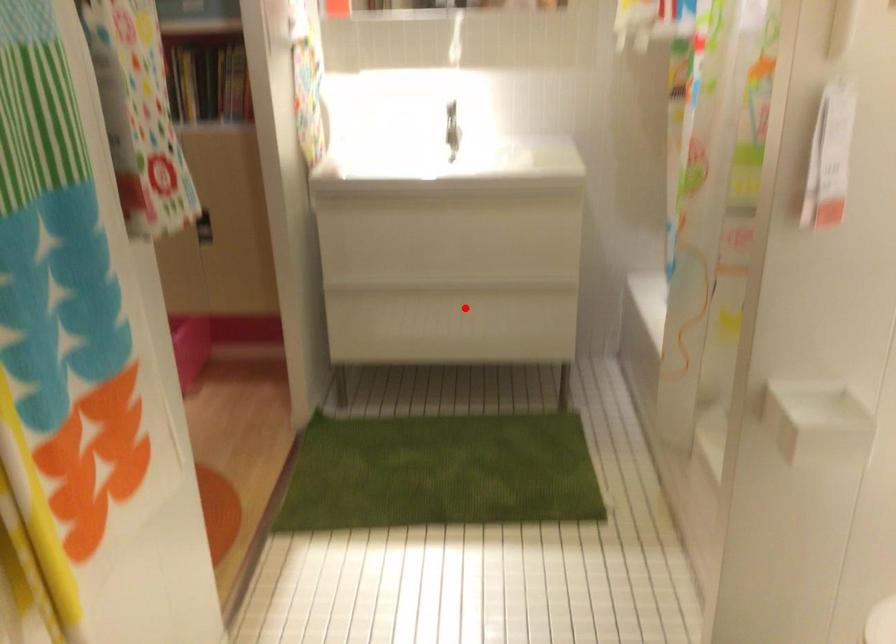
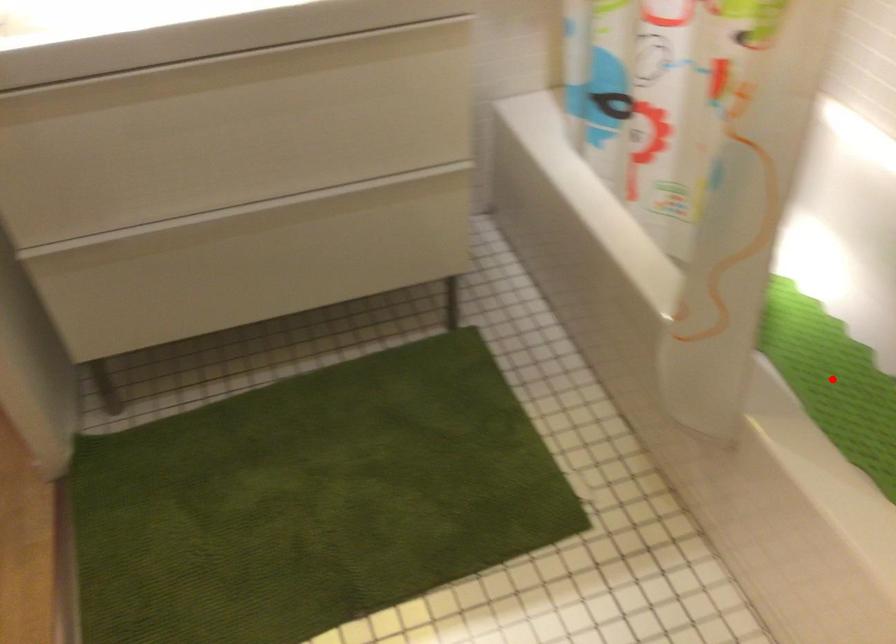
I am providing you with two images of the same scene from different viewpoints. A red point is marked on the first image and another point is marked on the second image. Does the point marked in image1 correspond to the same location as the one in image2?

No